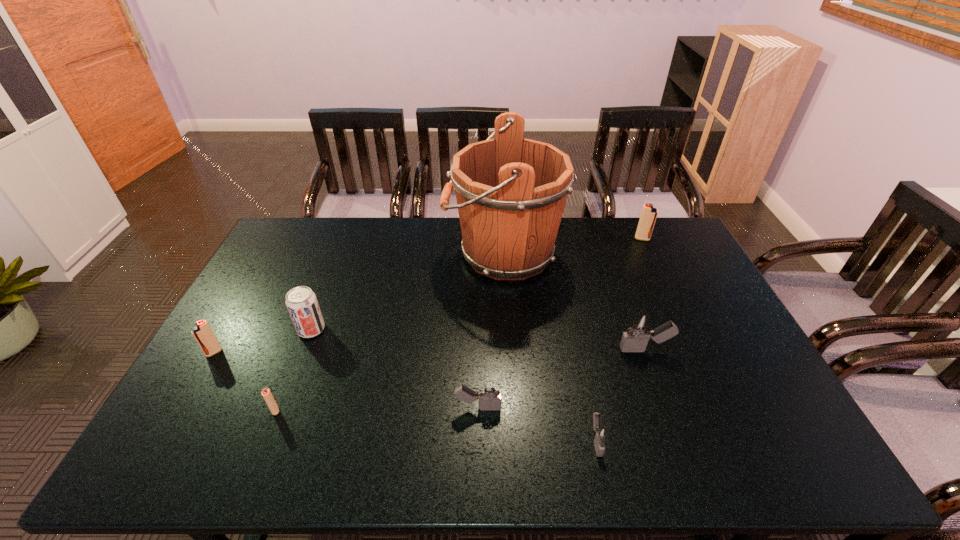
Choose which red igniter is the nearest neighbor to the nearest object. Please provide its 2D coordinates. Your answer should be formatted as a tuple, i.e. [(x, y)], where the tuple contains the x and y coordinates of a point satisfying the conditions above.

[(266, 393)]

Find the location of a particular element. The width and height of the screenshot is (960, 540). red igniter that is the second nearest to the farthest igniter is located at coordinates (203, 334).

The height and width of the screenshot is (540, 960). Identify the location of gray igniter identified as the closest to the soda can. (489, 393).

In order to click on gray igniter object that ranks as the second closest to the smallest gray igniter in this screenshot , I will do `click(638, 331)`.

You are a GUI agent. You are given a task and a screenshot of the screen. Output one action in this format:
    pyautogui.click(x=<x>, y=<y>)
    Task: Click on the free spot that satisfies the following two spatial constraints: 1. on the back side of the rightmost object; 2. on the left side of the second igniter from left to right
    The width and height of the screenshot is (960, 540).
    Given the screenshot: What is the action you would take?
    pyautogui.click(x=343, y=239)

Find the location of a particular element. The height and width of the screenshot is (540, 960). vacant area that satisfies the following two spatial constraints: 1. with the handle on the side of the tallest object; 2. on the left side of the rightmost gray igniter is located at coordinates (509, 350).

Find the location of `free space that satisfies the following two spatial constraints: 1. on the front side of the farthest igniter; 2. with the handle on the side of the bucket`. free space that satisfies the following two spatial constraints: 1. on the front side of the farthest igniter; 2. with the handle on the side of the bucket is located at coordinates (649, 253).

Find the location of `free spot that satisfies the following two spatial constraints: 1. on the back side of the farthest red igniter; 2. on the left side of the rightmost gray igniter`. free spot that satisfies the following two spatial constraints: 1. on the back side of the farthest red igniter; 2. on the left side of the rightmost gray igniter is located at coordinates point(605,239).